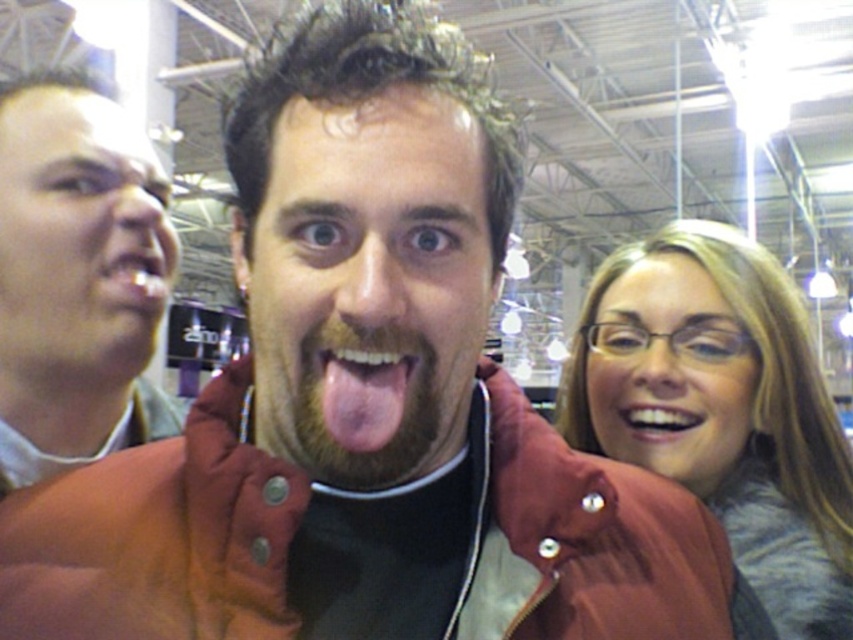
You are standing at the entrance of the convention center and see two points in the image. Which point is closer to you, point (750, 468) or point (635, 435)?

Point (635, 435) is closer to you because it is in front of point (750, 468).

Based on the scene description, where is the matte gray sweater at right located in terms of coordinates?

The matte gray sweater at right is located at point (724,410).